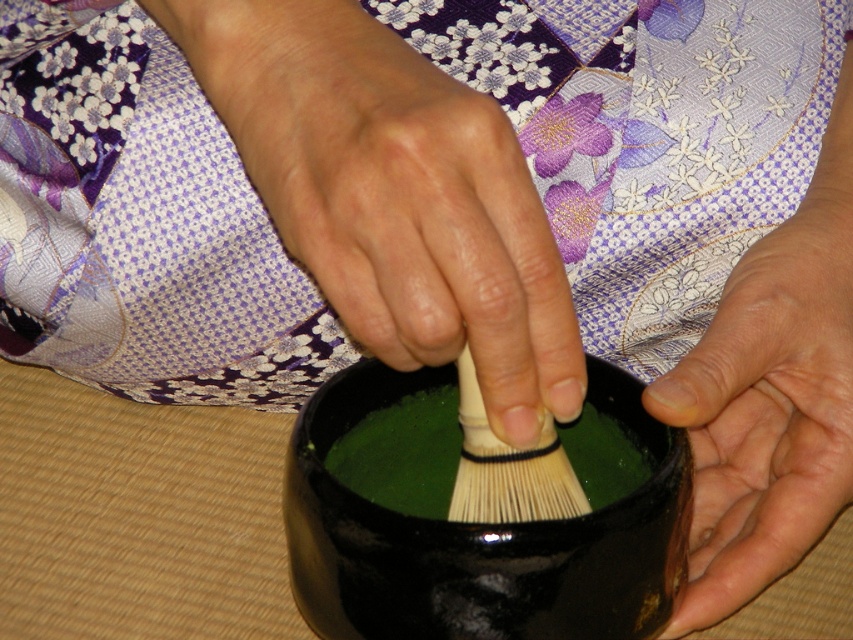
Is point (397, 147) positioned after point (477, 436)?

No, it is in front of (477, 436).

Between smooth beige brush at center and white bristle brush at center, which one has more height?

With more height is smooth beige brush at center.

Which is behind, point (521, 316) or point (480, 472)?

Point (480, 472)

This screenshot has width=853, height=640. In order to click on smooth beige brush at center in this screenshot , I will do `click(393, 195)`.

Is point (561, 540) farther from camera compared to point (816, 518)?

That is False.

Can you confirm if black glossy bowl at center is taller than smooth skin palm at lower right?

In fact, black glossy bowl at center may be shorter than smooth skin palm at lower right.

Which is behind, point (525, 616) or point (846, 454)?

The point (846, 454) is behind.

Where is `black glossy bowl at center`? This screenshot has width=853, height=640. black glossy bowl at center is located at coordinates (480, 536).

The image size is (853, 640). What do you see at coordinates (480, 536) in the screenshot?
I see `black glossy bowl at center` at bounding box center [480, 536].

Between point (347, 500) and point (544, 445), which one is positioned behind?

The point (544, 445) is behind.

Is point (289, 484) farther from viewer compared to point (543, 508)?

Yes, point (289, 484) is farther from viewer.

You are a GUI agent. You are given a task and a screenshot of the screen. Output one action in this format:
    pyautogui.click(x=<x>, y=<y>)
    Task: Click on the black glossy bowl at center
    The image size is (853, 640).
    Given the screenshot: What is the action you would take?
    pyautogui.click(x=480, y=536)